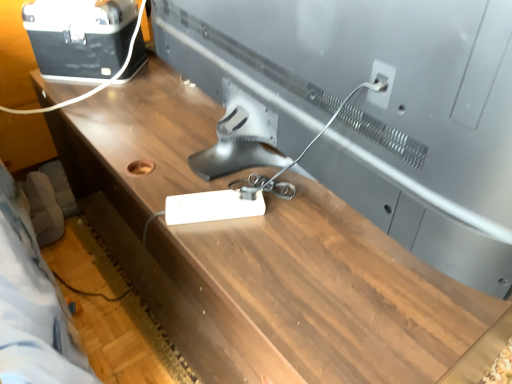
The height and width of the screenshot is (384, 512). I want to click on free location in front of matte black speaker at upper left, so click(104, 96).